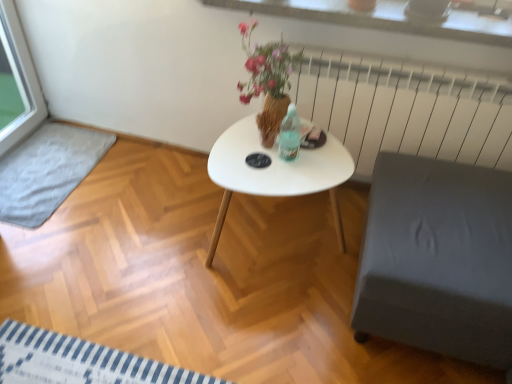
This screenshot has height=384, width=512. Identify the location of vacant area that lies between white matte coffee table at center and gray fabric mat at lower left. (151, 206).